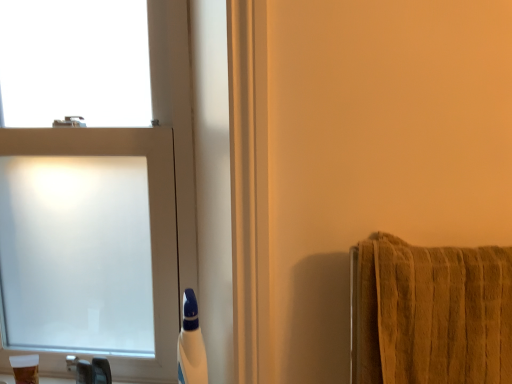
Question: From the image's perspective, does translucent plastic cup at lower left, positioned as the first toiletry in left-to-right order, appear lower than frosted glass window at left?

Choices:
 (A) no
 (B) yes

Answer: (B)

Question: Does translucent plastic cup at lower left, arranged as the second toiletry when viewed from the right, have a lesser height compared to frosted glass window at left?

Choices:
 (A) yes
 (B) no

Answer: (A)

Question: Is frosted glass window at left surrounded by translucent plastic cup at lower left, positioned as the first toiletry in left-to-right order?

Choices:
 (A) yes
 (B) no

Answer: (B)

Question: Is translucent plastic cup at lower left, positioned as the first toiletry in left-to-right order, completely or partially outside of frosted glass window at left?

Choices:
 (A) no
 (B) yes

Answer: (B)

Question: From a real-world perspective, is translucent plastic cup at lower left, arranged as the second toiletry when viewed from the right, on frosted glass window at left?

Choices:
 (A) yes
 (B) no

Answer: (B)

Question: Is translucent plastic cup at lower left, arranged as the second toiletry when viewed from the right, in front of or behind brushed metal faucet at lower left in the image?

Choices:
 (A) front
 (B) behind

Answer: (A)

Question: Based on their sizes in the image, would you say translucent plastic cup at lower left, positioned as the first toiletry in left-to-right order, is bigger or smaller than brushed metal faucet at lower left?

Choices:
 (A) small
 (B) big

Answer: (B)

Question: Is translucent plastic cup at lower left, arranged as the second toiletry when viewed from the right, spatially inside brushed metal faucet at lower left, or outside of it?

Choices:
 (A) outside
 (B) inside

Answer: (A)

Question: Is point (23, 380) positioned closer to the camera than point (93, 380)?

Choices:
 (A) farther
 (B) closer

Answer: (B)

Question: In the image, is frosted glass window at left on the left side or the right side of white plastic bottle at lower center, the first toiletry in the right-to-left sequence?

Choices:
 (A) left
 (B) right

Answer: (A)

Question: From the image's perspective, is frosted glass window at left positioned above or below white plastic bottle at lower center, the first toiletry in the right-to-left sequence?

Choices:
 (A) below
 (B) above

Answer: (B)

Question: Is point (162, 76) closer or farther from the camera than point (198, 324)?

Choices:
 (A) closer
 (B) farther

Answer: (B)

Question: From a real-world perspective, is frosted glass window at left positioned above or below white plastic bottle at lower center, the first toiletry in the right-to-left sequence?

Choices:
 (A) above
 (B) below

Answer: (A)

Question: From a real-world perspective, relative to translucent plastic cup at lower left, arranged as the second toiletry when viewed from the right, is white plastic bottle at lower center, the first toiletry in the right-to-left sequence, vertically above or below?

Choices:
 (A) below
 (B) above

Answer: (B)

Question: Considering the positions of white plastic bottle at lower center, the first toiletry in the right-to-left sequence, and translucent plastic cup at lower left, arranged as the second toiletry when viewed from the right, in the image, is white plastic bottle at lower center, the first toiletry in the right-to-left sequence, wider or thinner than translucent plastic cup at lower left, arranged as the second toiletry when viewed from the right,?

Choices:
 (A) wide
 (B) thin

Answer: (A)